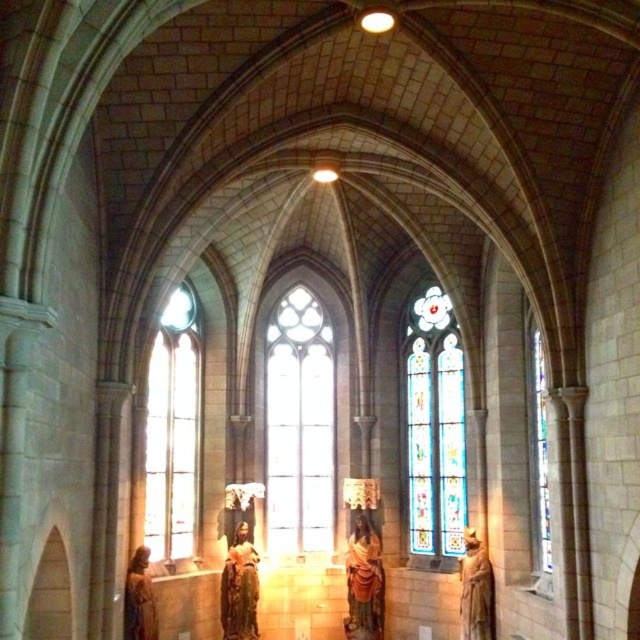
Does point (234, 570) come in front of point (483, 602)?

No, (234, 570) is further to viewer.

What are the coordinates of `golden statue at center` in the screenshot? It's located at (240, 588).

Is matte gold statue at right closer to camera compared to matte gold statue at lower left?

No, matte gold statue at right is further to the viewer.

Is point (474, 534) positioned in front of point (141, 580)?

That is False.

Where is `matte gold statue at right`? matte gold statue at right is located at coordinates click(476, 589).

Which is behind, point (172, 356) or point (474, 592)?

Positioned behind is point (172, 356).

Can you confirm if clear glass window at left is shorter than matte gold statue at right?

Incorrect, clear glass window at left's height does not fall short of matte gold statue at right's.

The width and height of the screenshot is (640, 640). What do you see at coordinates (172, 429) in the screenshot?
I see `clear glass window at left` at bounding box center [172, 429].

The width and height of the screenshot is (640, 640). What are the coordinates of `clear glass window at left` in the screenshot? It's located at (172, 429).